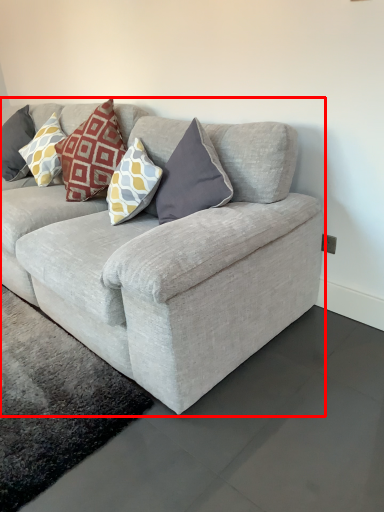
Question: Observing the image, what is the correct spatial positioning of studio couch (annotated by the red box) in reference to pillow?

Choices:
 (A) right
 (B) left

Answer: (A)